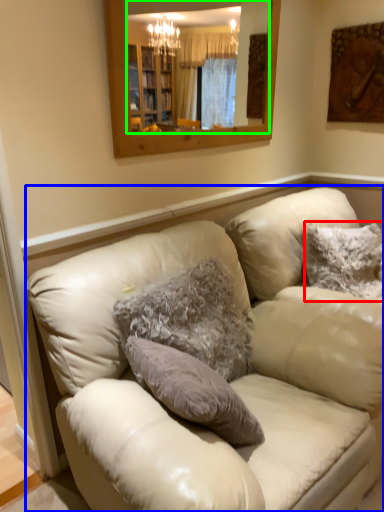
Question: Which object is positioned farthest from pillow (highlighted by a red box)? Select from studio couch (highlighted by a blue box) and mirror (highlighted by a green box).

Choices:
 (A) studio couch
 (B) mirror

Answer: (B)